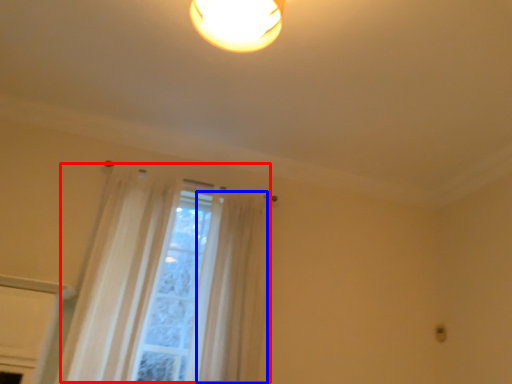
Question: Which object appears farthest to the camera in this image, curtain (highlighted by a red box) or curtain (highlighted by a blue box)?

Choices:
 (A) curtain
 (B) curtain

Answer: (B)